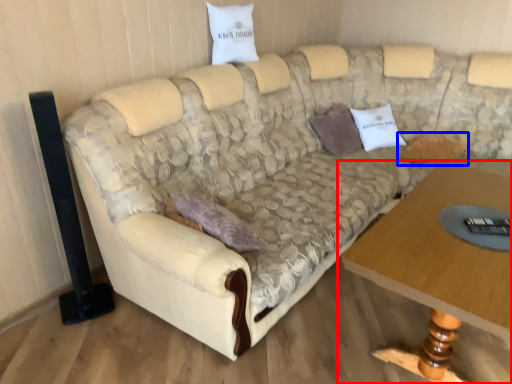
Question: Which object appears farthest to the camera in this image, table (highlighted by a red box) or pillow (highlighted by a blue box)?

Choices:
 (A) table
 (B) pillow

Answer: (B)